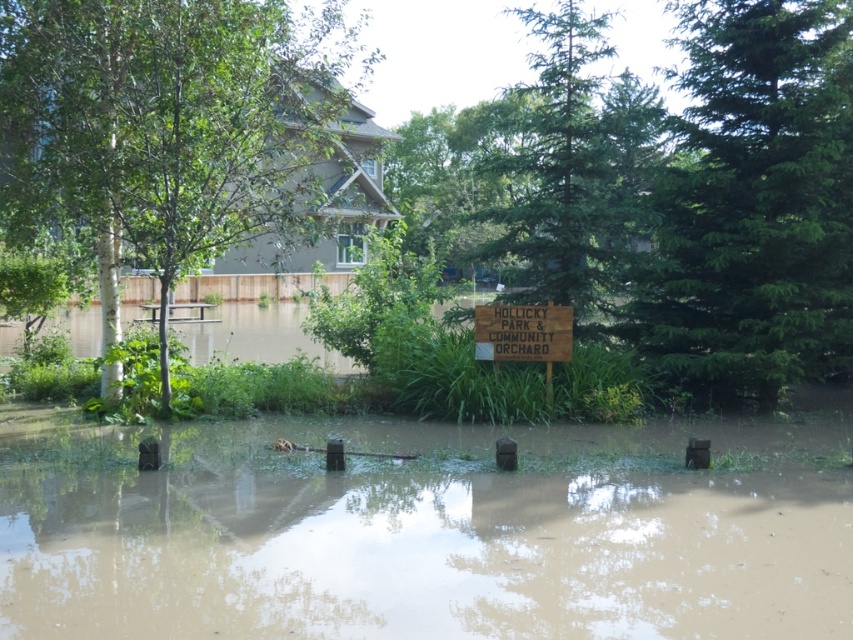
You are a hiker trying to navigate through Hollicky Park. You see the green textured pine tree at center and the wooden sign at center. Which object is positioned to the right of the other?

The green textured pine tree at center is to the right of the wooden sign at center.

You are standing in Hollicky Park and want to take a photo of the wooden sign at center without the green textured pine tree at center blocking the view. Which direction should you move to ensure the pine tree is no longer in front of the sign?

The green textured pine tree at center is in front of the wooden sign at center. To take a photo of the wooden sign at center without the pine tree blocking it, you should move to a position where the pine tree is no longer between you and the sign. This could involve moving to the side or behind the pine tree so that the sign becomes visible without obstruction.

You are a delivery drone trying to land in Hollicky Park. You need to avoid obstacles and land safely. The brown muddy water at lower center and the green leafy tree at left are in your path. Which one is closer to your current position?

The brown muddy water at lower center is 11.85 meters away from the green leafy tree at left. Since the question asks which is closer to your current position, but the distance between them is provided, we cannot determine which is closer to the drone without knowing the drone position relative to both. However, based on the given information, the brown muddy water at lower center is 11.85 meters away from the green leafy tree at left.